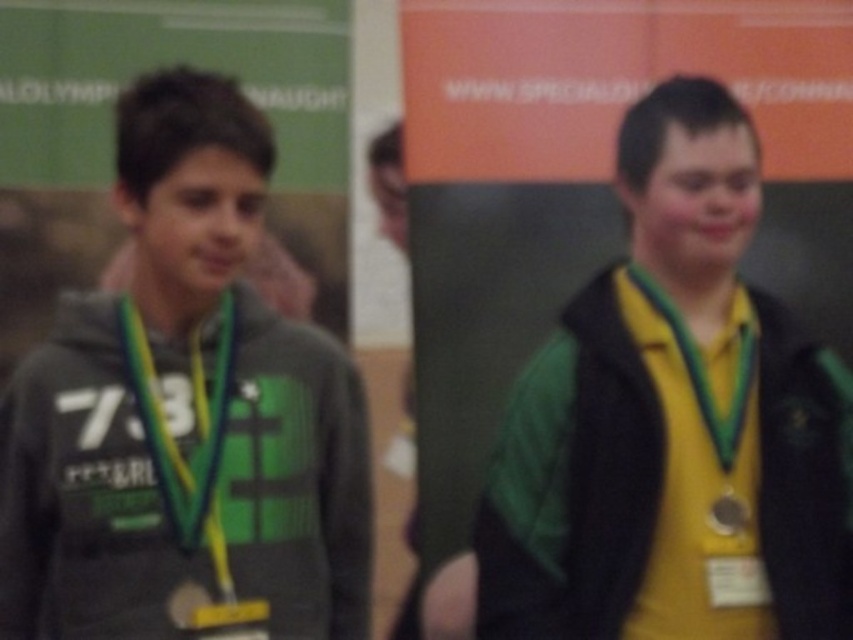
Measure the distance between black matte vest at right and yellow-green lanyard at right.

The distance of black matte vest at right from yellow-green lanyard at right is 9.17 inches.

Is point (529, 609) closer to viewer compared to point (724, 298)?

Yes, point (529, 609) is in front of point (724, 298).

Where is `black matte vest at right`? Image resolution: width=853 pixels, height=640 pixels. black matte vest at right is located at coordinates (583, 496).

Does matte green hoodie at left come behind green fabric neck at center?

No.

Describe the element at coordinates (186, 420) in the screenshot. I see `matte green hoodie at left` at that location.

Find the location of a particular element. Image resolution: width=853 pixels, height=640 pixels. matte green hoodie at left is located at coordinates (186, 420).

How distant is black matte vest at right from green fabric neck at center?

A distance of 32.24 inches exists between black matte vest at right and green fabric neck at center.

Does black matte vest at right have a smaller size compared to green fabric neck at center?

Actually, black matte vest at right might be larger than green fabric neck at center.

Between point (590, 518) and point (183, 310), which one is positioned behind?

The point (183, 310) is more distant.

The width and height of the screenshot is (853, 640). I want to click on black matte vest at right, so click(583, 496).